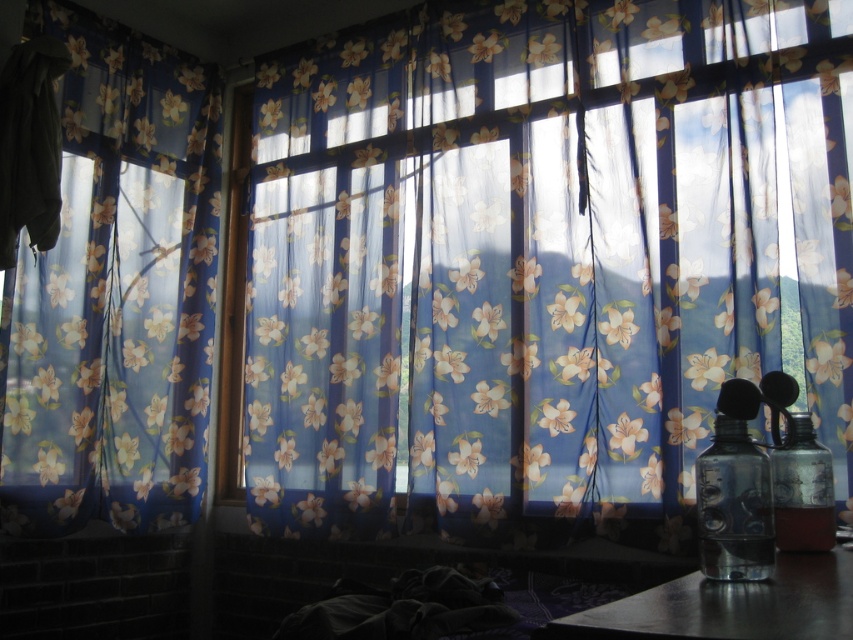
Question: Based on their relative distances, which object is nearer to the blue sheer floral curtain at left?

Choices:
 (A) transparent glass bottle at right
 (B) translucent plastic bottle at right
 (C) floral sheer curtains at center

Answer: (C)

Question: Which point is farther to the camera?

Choices:
 (A) metallic dark gray table at lower right
 (B) translucent plastic bottle at right

Answer: (B)

Question: Estimate the real-world distances between objects in this image. Which object is closer to the translucent plastic bottle at right?

Choices:
 (A) floral sheer curtains at center
 (B) blue sheer floral curtain at left
 (C) transparent glass bottle at right

Answer: (C)

Question: Is blue sheer floral curtain at left bigger than translucent plastic bottle at right?

Choices:
 (A) yes
 (B) no

Answer: (A)

Question: Is blue sheer floral curtain at left behind transparent glass bottle at right?

Choices:
 (A) yes
 (B) no

Answer: (A)

Question: Can you confirm if transparent glass bottle at right is positioned to the right of translucent plastic bottle at right?

Choices:
 (A) no
 (B) yes

Answer: (A)